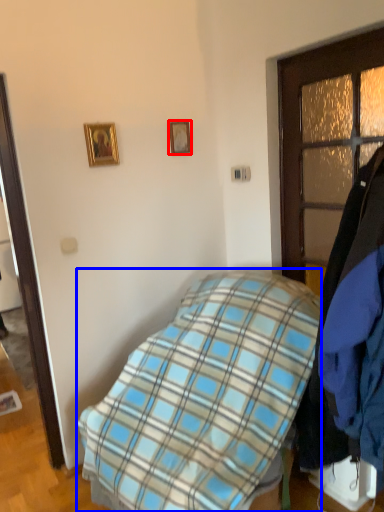
Question: Which object appears farthest to the camera in this image, picture frame (highlighted by a red box) or bed (highlighted by a blue box)?

Choices:
 (A) picture frame
 (B) bed

Answer: (A)